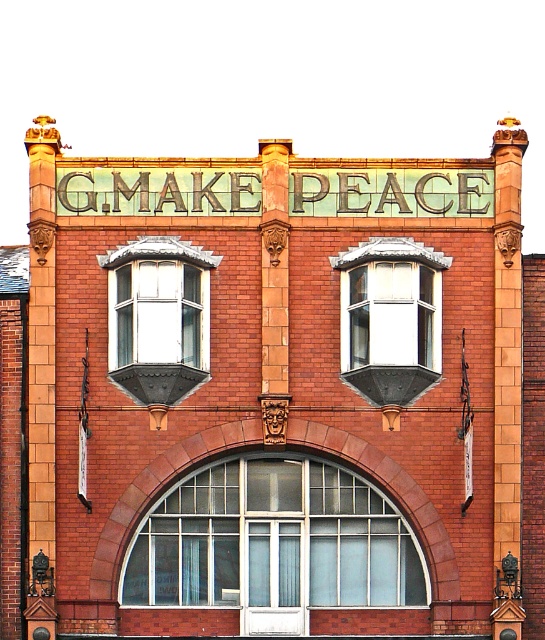
You are a window installer who needs to place a new 7.0 meter long decorative panel between the two bay windows. Based on the scene, will the panel fit between the matte glass bay window at center and the clear glass bay window at center?

The distance between the matte glass bay window at center and the clear glass bay window at center is 6.80 meters. Since the panel is 7.0 meters long, it will not fit between them as the space is shorter than the panel.

You are an architect reviewing the building facade. You notice the clear glass window at center and the clear glass bay window at center. Which one is located above the other?

The clear glass bay window at center is above the clear glass window at center because the description states that the clear glass window at center is positioned under the clear glass bay window at center.